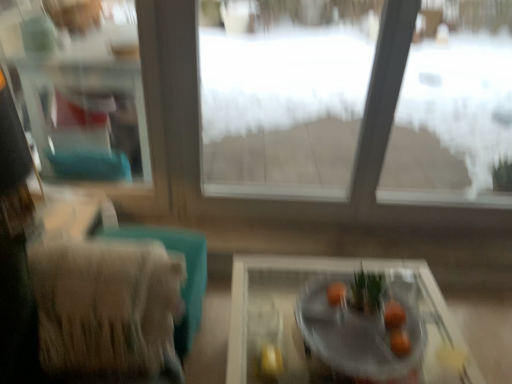
Question: Should I look upward or downward to see beige fabric armchair at left?

Choices:
 (A) up
 (B) down

Answer: (B)

Question: From a real-world perspective, does beige fabric armchair at left sit lower than orange matte at center?

Choices:
 (A) no
 (B) yes

Answer: (B)

Question: Is beige fabric armchair at left aimed at orange matte at center?

Choices:
 (A) yes
 (B) no

Answer: (A)

Question: Does beige fabric armchair at left come behind orange matte at center?

Choices:
 (A) yes
 (B) no

Answer: (A)

Question: Is beige fabric armchair at left smaller than orange matte at center?

Choices:
 (A) no
 (B) yes

Answer: (A)

Question: From the image's perspective, would you say beige fabric armchair at left is positioned over orange matte at center?

Choices:
 (A) no
 (B) yes

Answer: (A)

Question: From a real-world perspective, is beige fabric armchair at left on top of orange matte at center?

Choices:
 (A) no
 (B) yes

Answer: (A)

Question: Does clear glass bowl at center appear on the left side of transparent glass window at center?

Choices:
 (A) no
 (B) yes

Answer: (A)

Question: Is transparent glass window at center located within clear glass bowl at center?

Choices:
 (A) no
 (B) yes

Answer: (A)

Question: Considering the relative sizes of clear glass bowl at center and transparent glass window at center in the image provided, is clear glass bowl at center shorter than transparent glass window at center?

Choices:
 (A) no
 (B) yes

Answer: (B)

Question: From a real-world perspective, does clear glass bowl at center stand above transparent glass window at center?

Choices:
 (A) yes
 (B) no

Answer: (B)

Question: Would you say clear glass bowl at center is outside transparent glass window at center?

Choices:
 (A) no
 (B) yes

Answer: (B)

Question: From a real-world perspective, is clear glass bowl at center beneath transparent glass window at center?

Choices:
 (A) no
 (B) yes

Answer: (B)

Question: Would you say orange matte at center is part of clear glass window frame at upper left's contents?

Choices:
 (A) no
 (B) yes

Answer: (A)